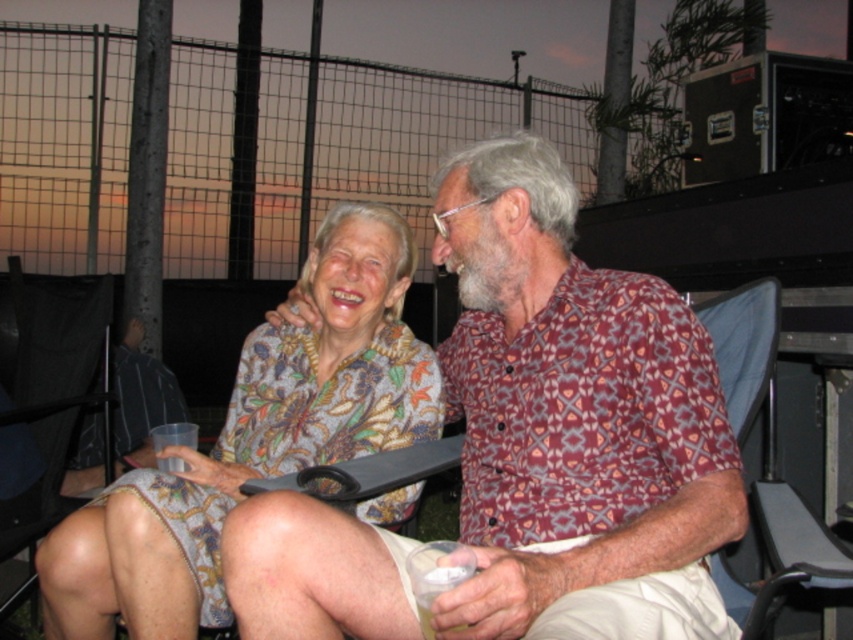
Between blue fabric beach chair at right and black mesh chair at lower left, which one is positioned lower?

blue fabric beach chair at right is below.

Is blue fabric beach chair at right wider than black mesh chair at lower left?

No, blue fabric beach chair at right is not wider than black mesh chair at lower left.

Who is more forward, (759, 308) or (62, 406)?

Point (759, 308) is more forward.

I want to click on blue fabric beach chair at right, so click(x=764, y=461).

Which is above, printed fabric shirt at center or blue fabric beach chair at right?

printed fabric shirt at center is higher up.

Who is more distant from viewer, (602, 561) or (749, 620)?

Positioned behind is point (749, 620).

The image size is (853, 640). Identify the location of printed fabric shirt at center. (573, 419).

Looking at this image, between printed fabric shirt at center and clear plastic cup at lower left, which one is positioned higher?

printed fabric shirt at center is above.

In the scene shown: Does printed fabric shirt at center have a larger size compared to clear plastic cup at lower left?

Correct, printed fabric shirt at center is larger in size than clear plastic cup at lower left.

Is point (512, 177) farther from viewer compared to point (175, 397)?

No.

Identify the location of printed fabric shirt at center. The width and height of the screenshot is (853, 640). (573, 419).